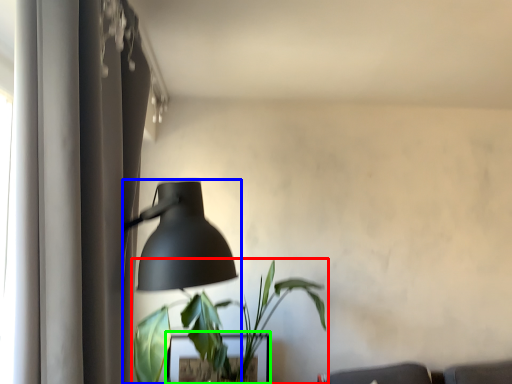
Question: Which object is positioned closest to houseplant (highlighted by a red box)? Select from lamp (highlighted by a blue box) and table (highlighted by a green box).

Choices:
 (A) lamp
 (B) table

Answer: (A)